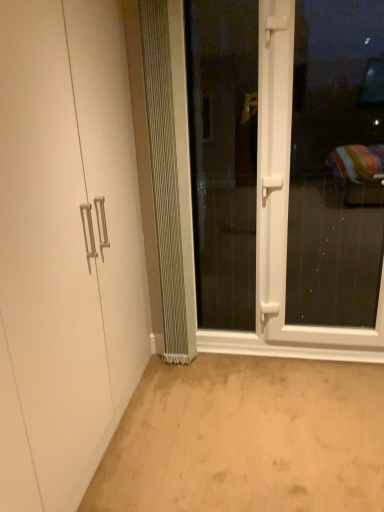
Question: Is white plastic screen door at center, the 2th screen door from the left, next to metallic silver radiator at center?

Choices:
 (A) yes
 (B) no

Answer: (B)

Question: Considering the relative sizes of white plastic screen door at center, which is the first screen door from right to left, and metallic silver radiator at center in the image provided, is white plastic screen door at center, which is the first screen door from right to left, smaller than metallic silver radiator at center?

Choices:
 (A) yes
 (B) no

Answer: (B)

Question: Can you confirm if white plastic screen door at center, which is the first screen door from right to left, is shorter than metallic silver radiator at center?

Choices:
 (A) no
 (B) yes

Answer: (B)

Question: Does white plastic screen door at center, which is the first screen door from right to left, appear on the left side of metallic silver radiator at center?

Choices:
 (A) yes
 (B) no

Answer: (B)

Question: From the image's perspective, is white plastic screen door at center, which is the first screen door from right to left, located beneath metallic silver radiator at center?

Choices:
 (A) yes
 (B) no

Answer: (A)

Question: Considering the positions of point (180, 129) and point (92, 390), is point (180, 129) closer or farther from the camera than point (92, 390)?

Choices:
 (A) farther
 (B) closer

Answer: (A)

Question: In terms of width, does metallic silver radiator at center look wider or thinner when compared to white matte cabinet at left?

Choices:
 (A) wide
 (B) thin

Answer: (B)

Question: From a real-world perspective, is metallic silver radiator at center above or below white matte cabinet at left?

Choices:
 (A) above
 (B) below

Answer: (B)

Question: From the image's perspective, is metallic silver radiator at center positioned above or below white matte cabinet at left?

Choices:
 (A) below
 (B) above

Answer: (B)

Question: Based on their sizes in the image, would you say white matte cabinet at left is bigger or smaller than white plastic screen door at center, the 2th screen door from the left?

Choices:
 (A) big
 (B) small

Answer: (A)

Question: In the image, is white matte cabinet at left on the left side or the right side of white plastic screen door at center, which is the first screen door from right to left?

Choices:
 (A) right
 (B) left

Answer: (B)

Question: Choose the correct answer: Is white matte cabinet at left inside white plastic screen door at center, the 2th screen door from the left, or outside it?

Choices:
 (A) inside
 (B) outside

Answer: (B)

Question: Is white matte cabinet at left taller or shorter than white plastic screen door at center, the 2th screen door from the left?

Choices:
 (A) tall
 (B) short

Answer: (A)

Question: Based on their sizes in the image, would you say beige carpet at lower center is bigger or smaller than clear glass screen door at center, which ranks as the 1th screen door in left-to-right order?

Choices:
 (A) small
 (B) big

Answer: (B)

Question: Is point (x=331, y=509) closer or farther from the camera than point (x=206, y=291)?

Choices:
 (A) closer
 (B) farther

Answer: (A)